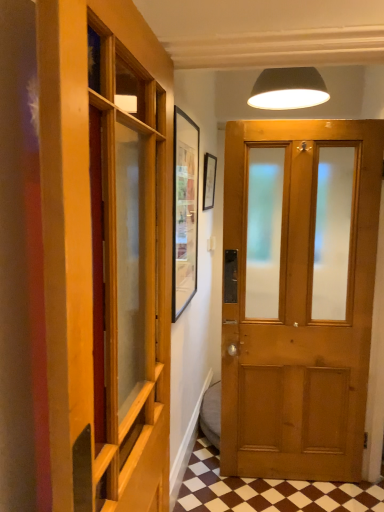
Question: Is wooden paneling at left further to the viewer compared to matte wooden door at center?

Choices:
 (A) no
 (B) yes

Answer: (A)

Question: Is wooden paneling at left shorter than matte wooden door at center?

Choices:
 (A) no
 (B) yes

Answer: (B)

Question: Can you confirm if wooden paneling at left is bigger than matte wooden door at center?

Choices:
 (A) yes
 (B) no

Answer: (A)

Question: Considering the relative sizes of wooden paneling at left and matte wooden door at center in the image provided, is wooden paneling at left thinner than matte wooden door at center?

Choices:
 (A) yes
 (B) no

Answer: (B)

Question: Could matte wooden door at center be considered to be inside wooden paneling at left?

Choices:
 (A) yes
 (B) no

Answer: (B)

Question: From a real-world perspective, is brown checkered tile at lower center physically located above or below matte wooden door at center?

Choices:
 (A) below
 (B) above

Answer: (A)

Question: Is brown checkered tile at lower center bigger or smaller than matte wooden door at center?

Choices:
 (A) big
 (B) small

Answer: (B)

Question: Considering the positions of point (198, 436) and point (334, 264), is point (198, 436) closer or farther from the camera than point (334, 264)?

Choices:
 (A) farther
 (B) closer

Answer: (A)

Question: From the image's perspective, is brown checkered tile at lower center located above or below matte wooden door at center?

Choices:
 (A) below
 (B) above

Answer: (A)

Question: From the image's perspective, is wooden paneling at left located above or below brown checkered tile at lower center?

Choices:
 (A) below
 (B) above

Answer: (B)

Question: Which is correct: wooden paneling at left is inside brown checkered tile at lower center, or outside of it?

Choices:
 (A) inside
 (B) outside

Answer: (B)

Question: In the image, is wooden paneling at left on the left side or the right side of brown checkered tile at lower center?

Choices:
 (A) right
 (B) left

Answer: (B)

Question: Is wooden paneling at left wider or thinner than brown checkered tile at lower center?

Choices:
 (A) wide
 (B) thin

Answer: (B)

Question: Is matte black lampshade at upper center in front of or behind brown checkered tile at lower center in the image?

Choices:
 (A) behind
 (B) front

Answer: (A)

Question: Considering the relative positions of matte black lampshade at upper center and brown checkered tile at lower center in the image provided, is matte black lampshade at upper center to the left or to the right of brown checkered tile at lower center?

Choices:
 (A) right
 (B) left

Answer: (B)